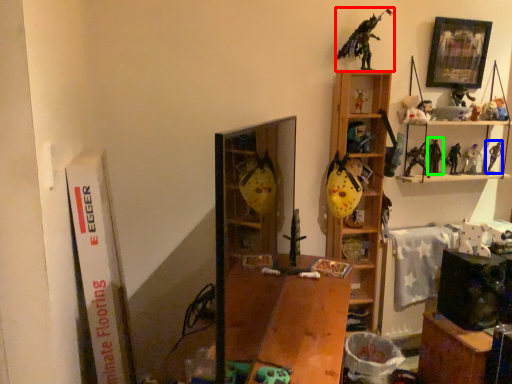
Question: Estimate the real-world distances between objects in this image. Which object is closer to toy (highlighted by a red box), toy (highlighted by a blue box) or toy (highlighted by a green box)?

Choices:
 (A) toy
 (B) toy

Answer: (B)